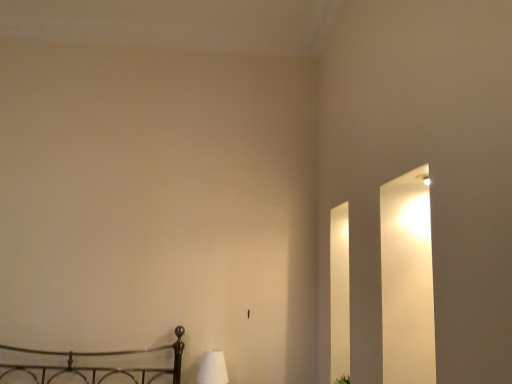
Describe the element at coordinates (212, 368) in the screenshot. I see `white fabric lampshade at lower left` at that location.

The image size is (512, 384). I want to click on white fabric lampshade at lower left, so click(212, 368).

Where is `green leafy plant at lower right`? The height and width of the screenshot is (384, 512). green leafy plant at lower right is located at coordinates (343, 379).

The image size is (512, 384). What do you see at coordinates (343, 379) in the screenshot? I see `green leafy plant at lower right` at bounding box center [343, 379].

Locate an element on the screen. The image size is (512, 384). white fabric lampshade at lower left is located at coordinates (212, 368).

Is white fabric lampshade at lower left at the left side of green leafy plant at lower right?

Correct, you'll find white fabric lampshade at lower left to the left of green leafy plant at lower right.

Considering the relative positions of white fabric lampshade at lower left and green leafy plant at lower right in the image provided, is white fabric lampshade at lower left in front of green leafy plant at lower right?

No, the depth of white fabric lampshade at lower left is greater than that of green leafy plant at lower right.

Considering the positions of point (202, 361) and point (348, 377), is point (202, 361) closer or farther from the camera than point (348, 377)?

Point (202, 361) appears to be farther away from the viewer than point (348, 377).

From the image's perspective, is white fabric lampshade at lower left on green leafy plant at lower right?

Yes, from the image's perspective, white fabric lampshade at lower left is on top of green leafy plant at lower right.

From a real-world perspective, is white fabric lampshade at lower left under green leafy plant at lower right?

No, from a real-world perspective, white fabric lampshade at lower left is not beneath green leafy plant at lower right.

Looking at this image, can you confirm if white fabric lampshade at lower left is wider than green leafy plant at lower right?

Yes, white fabric lampshade at lower left is wider than green leafy plant at lower right.

Considering the relative sizes of white fabric lampshade at lower left and green leafy plant at lower right in the image provided, is white fabric lampshade at lower left shorter than green leafy plant at lower right?

Incorrect, the height of white fabric lampshade at lower left does not fall short of that of green leafy plant at lower right.

Considering the sizes of objects white fabric lampshade at lower left and green leafy plant at lower right in the image provided, who is smaller, white fabric lampshade at lower left or green leafy plant at lower right?

Smaller between the two is green leafy plant at lower right.

Is white fabric lampshade at lower left positioned beyond the bounds of green leafy plant at lower right?

Yes, white fabric lampshade at lower left is outside of green leafy plant at lower right.

Is white fabric lampshade at lower left far away from green leafy plant at lower right?

Actually, white fabric lampshade at lower left and green leafy plant at lower right are a little close together.

Could you tell me if white fabric lampshade at lower left is facing green leafy plant at lower right?

No, white fabric lampshade at lower left is not facing towards green leafy plant at lower right.

From the picture: Measure the distance from white fabric lampshade at lower left to green leafy plant at lower right.

34.50 inches.

Identify the location of lamp above the green leafy plant at lower right (from a real-world perspective). This screenshot has height=384, width=512. (212, 368).

Which is more to the left, green leafy plant at lower right or white fabric lampshade at lower left?

white fabric lampshade at lower left is more to the left.

Which is behind, green leafy plant at lower right or white fabric lampshade at lower left?

Positioned behind is white fabric lampshade at lower left.

Between point (347, 378) and point (217, 366), which one is positioned behind?

The point (217, 366) is farther.

From the image's perspective, is green leafy plant at lower right positioned above or below white fabric lampshade at lower left?

green leafy plant at lower right is situated lower than white fabric lampshade at lower left in the image.

From a real-world perspective, who is located lower, green leafy plant at lower right or white fabric lampshade at lower left?

green leafy plant at lower right.

Based on the photo, can you confirm if green leafy plant at lower right is thinner than white fabric lampshade at lower left?

Yes.

Is green leafy plant at lower right taller than white fabric lampshade at lower left?

Incorrect, the height of green leafy plant at lower right is not larger of that of white fabric lampshade at lower left.

Which of these two, green leafy plant at lower right or white fabric lampshade at lower left, is smaller?

green leafy plant at lower right.

Is white fabric lampshade at lower left located within green leafy plant at lower right?

No, white fabric lampshade at lower left is located outside of green leafy plant at lower right.

In the scene shown: Would you consider green leafy plant at lower right to be distant from white fabric lampshade at lower left?

No, green leafy plant at lower right is not far away from white fabric lampshade at lower left.

Is green leafy plant at lower right turned away from white fabric lampshade at lower left?

That's not correct — green leafy plant at lower right is not looking away from white fabric lampshade at lower left.

How different are the orientations of green leafy plant at lower right and white fabric lampshade at lower left in degrees?

42 degrees.

What are the coordinates of `plant located on the right of white fabric lampshade at lower left` in the screenshot? It's located at (343, 379).

Locate an element on the screen. plant below the white fabric lampshade at lower left (from the image's perspective) is located at coordinates tap(343, 379).

I want to click on lamp that is above the green leafy plant at lower right (from the image's perspective), so click(x=212, y=368).